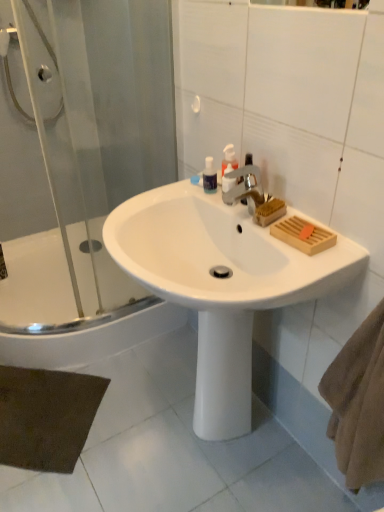
Find the location of a particular element. This screenshot has width=384, height=512. free space to the left of transparent plastic mouthwash at upper center is located at coordinates (161, 197).